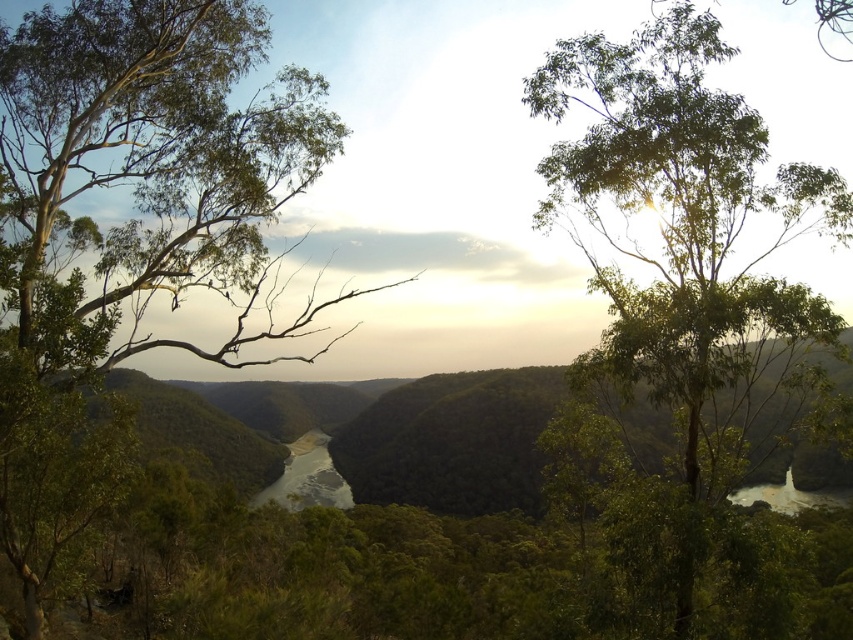
Who is more distant from viewer, (241, 336) or (282, 497)?

The point (282, 497) is more distant.

Can you confirm if green leafy tree at left is taller than green smooth river at center?

Indeed, green leafy tree at left has a greater height compared to green smooth river at center.

I want to click on green leafy tree at left, so click(148, 173).

At what (x,y) coordinates should I click in order to perform the action: click on green leafy tree at left. Please return your answer as a coordinate pair (x, y). This screenshot has height=640, width=853. Looking at the image, I should click on (148, 173).

Can you confirm if green leafy tree at upper center is shorter than green smooth river at center?

Yes, green leafy tree at upper center is shorter than green smooth river at center.

Between green leafy tree at upper center and green smooth river at center, which one is positioned higher?

green leafy tree at upper center is higher up.

Which is behind, point (634, 65) or point (349, 506)?

The point (349, 506) is more distant.

You are a GUI agent. You are given a task and a screenshot of the screen. Output one action in this format:
    pyautogui.click(x=<x>, y=<y>)
    Task: Click on the green leafy tree at upper center
    The image size is (853, 640).
    Given the screenshot: What is the action you would take?
    pyautogui.click(x=682, y=220)

Can you confirm if green leafy tree at left is positioned to the right of green leafy tree at upper center?

In fact, green leafy tree at left is to the left of green leafy tree at upper center.

The image size is (853, 640). What do you see at coordinates (148, 173) in the screenshot? I see `green leafy tree at left` at bounding box center [148, 173].

I want to click on green leafy tree at left, so click(148, 173).